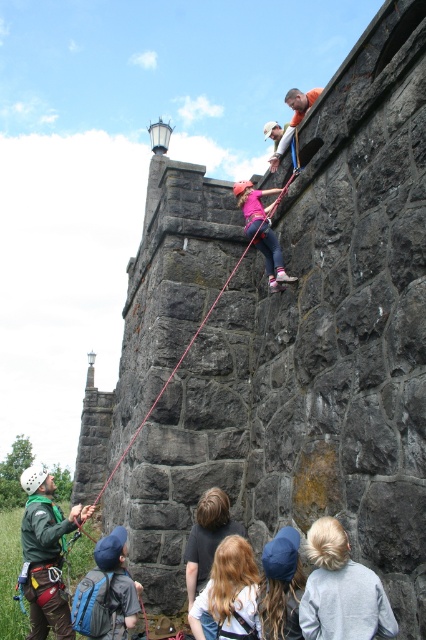
Is point (43, 556) in front of point (267, 227)?

That is True.

Who is shorter, green fabric harness at lower left or pink fabric climbing harness at center?

pink fabric climbing harness at center is shorter.

Image resolution: width=426 pixels, height=640 pixels. I want to click on green fabric harness at lower left, so click(x=46, y=554).

You are a GUI agent. You are given a task and a screenshot of the screen. Output one action in this format:
    pyautogui.click(x=<x>, y=<y>)
    Task: Click on the green fabric harness at lower left
    
    Given the screenshot: What is the action you would take?
    pyautogui.click(x=46, y=554)

This screenshot has width=426, height=640. Describe the element at coordinates (46, 554) in the screenshot. I see `green fabric harness at lower left` at that location.

Between green fabric harness at lower left and red nylon rope at center, which one is positioned lower?

green fabric harness at lower left

Between point (60, 561) and point (242, 256), which one is positioned behind?

The point (242, 256) is more distant.

At what (x,y) coordinates should I click in order to perform the action: click on green fabric harness at lower left. Please return your answer as a coordinate pair (x, y). The height and width of the screenshot is (640, 426). Looking at the image, I should click on (46, 554).

Is the position of blonde hair at center less distant than that of red nylon rope at center?

That is True.

Looking at this image, which is more to the right, blonde hair at center or red nylon rope at center?

From the viewer's perspective, blonde hair at center appears more on the right side.

Does point (233, 557) come closer to viewer compared to point (164, 385)?

That is True.

Identify the location of blonde hair at center. Image resolution: width=426 pixels, height=640 pixels. (229, 589).